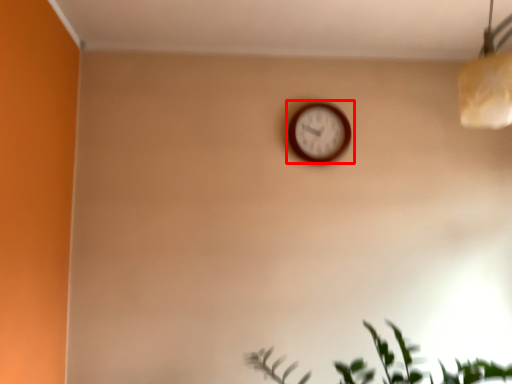
Question: In this image, where is wall clock (annotated by the red box) located relative to houseplant?

Choices:
 (A) right
 (B) left

Answer: (B)